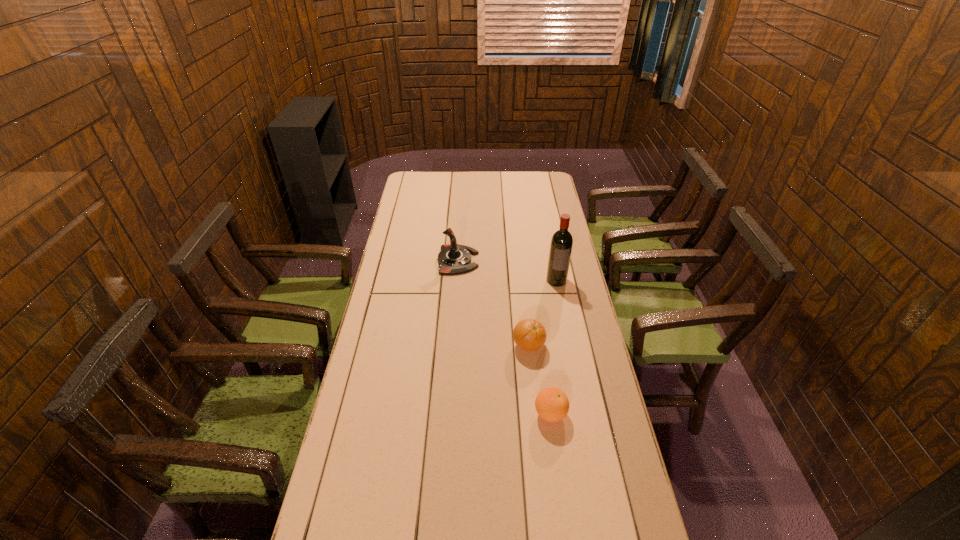
You are a GUI agent. You are given a task and a screenshot of the screen. Output one action in this format:
    pyautogui.click(x=<x>, y=<y>)
    Task: Click on the free space between the nearest object and the wine bottle
    
    Given the screenshot: What is the action you would take?
    pyautogui.click(x=553, y=347)

This screenshot has height=540, width=960. I want to click on free space between the third farthest object and the nearer orange, so click(x=540, y=380).

The image size is (960, 540). Identify the location of empty space between the third shortest object and the tallest object. coord(507,271).

Find the location of `unoccupied position between the nearest object and the rightmost object`. unoccupied position between the nearest object and the rightmost object is located at coordinates (553, 347).

I want to click on free spot between the joystick and the third farthest object, so click(493, 303).

Find the location of a particular element. free spot between the nearer orange and the wine bottle is located at coordinates (553, 347).

Find the location of a particular element. object that stands as the third closest to the farther orange is located at coordinates (453, 259).

The height and width of the screenshot is (540, 960). I want to click on the third closest object to the second tallest object, so click(552, 404).

At what (x,y) coordinates should I click in order to perform the action: click on free spot that satisfies the following two spatial constraints: 1. on the handle side of the joystick; 2. on the left side of the farther orange. Please return your answer as a coordinate pair (x, y). This screenshot has width=960, height=540. Looking at the image, I should click on (452, 346).

Locate an element on the screen. vacant space that satisfies the following two spatial constraints: 1. on the handle side of the joystick; 2. on the right side of the nearer orange is located at coordinates (448, 414).